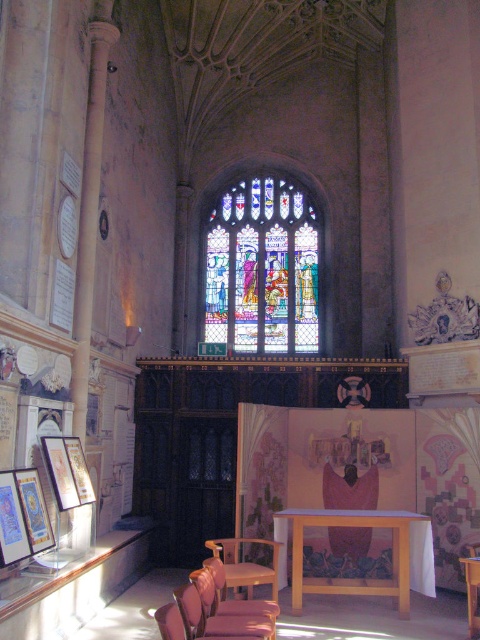
Consider the image. You are a visitor standing at the entrance of the church. You see the stained glass window at center and the wooden chair at lower center. Which object is closer to you?

The wooden chair at lower center is behind the stained glass window at center, so the stained glass window at center is closer to you.

You are an interior designer planning to place a new rectangular table in the church. The table must be positioned between the stained glass window at center and the wooden chair at lower center. Given their widths, which object should the table be aligned with to ensure it fits properly?

The stained glass window at center is wider than the wooden chair at lower center. To ensure the table fits properly, it should be aligned with the stained glass window at center since it has a greater width.